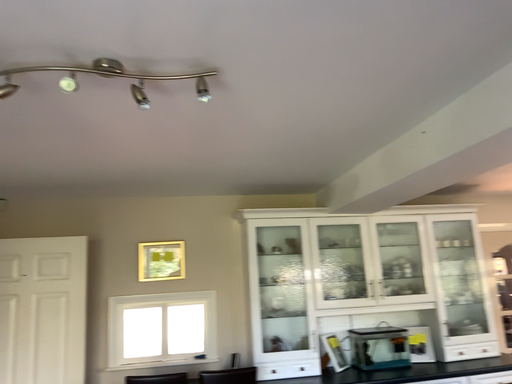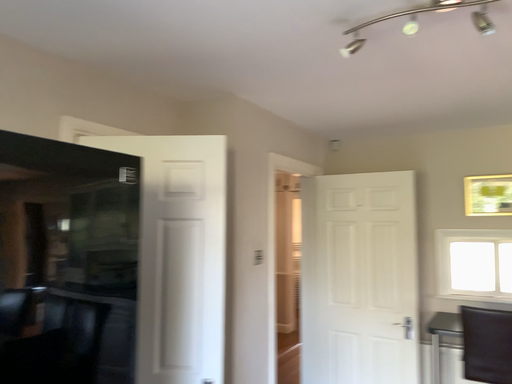
Question: How did the camera likely rotate when shooting the video?

Choices:
 (A) rotated upward
 (B) rotated downward

Answer: (B)